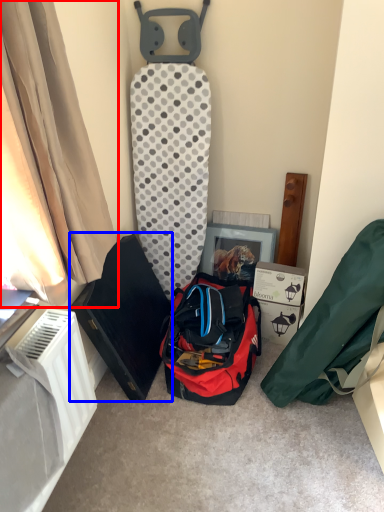
Question: Which of the following is the closest to the observer, curtain (highlighted by a red box) or kit (highlighted by a blue box)?

Choices:
 (A) curtain
 (B) kit

Answer: (A)